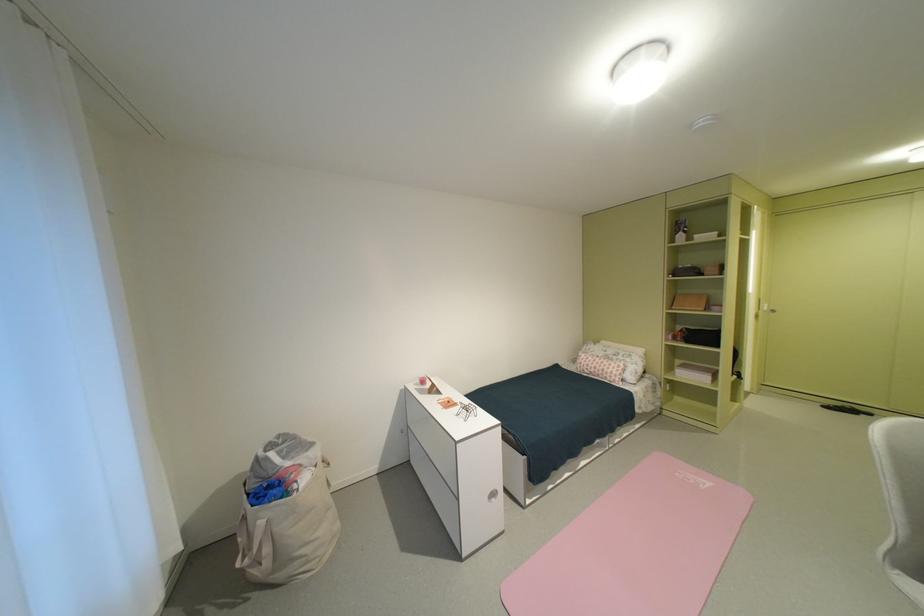
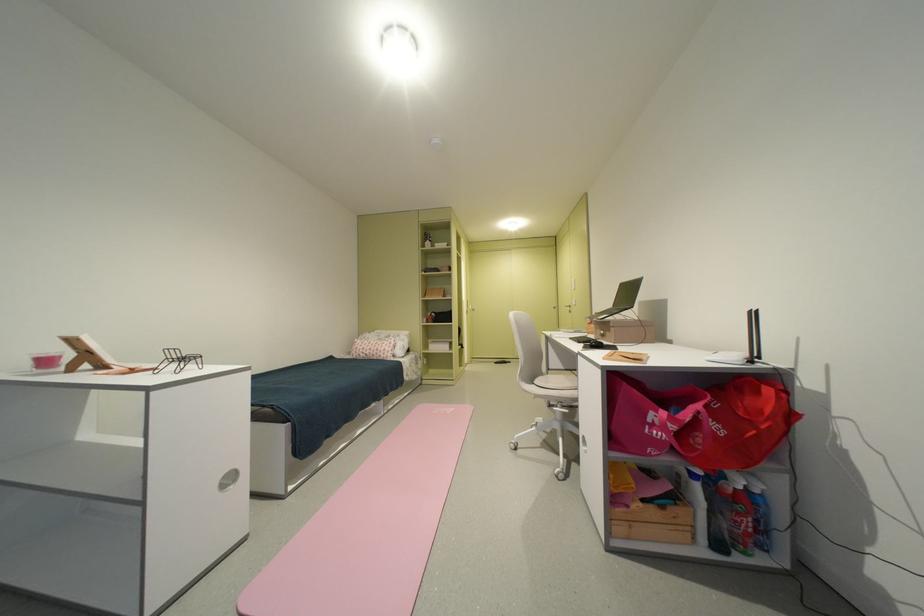
The point at (x=616, y=374) is marked in the first image. Where is the corresponding point in the second image?

(390, 352)